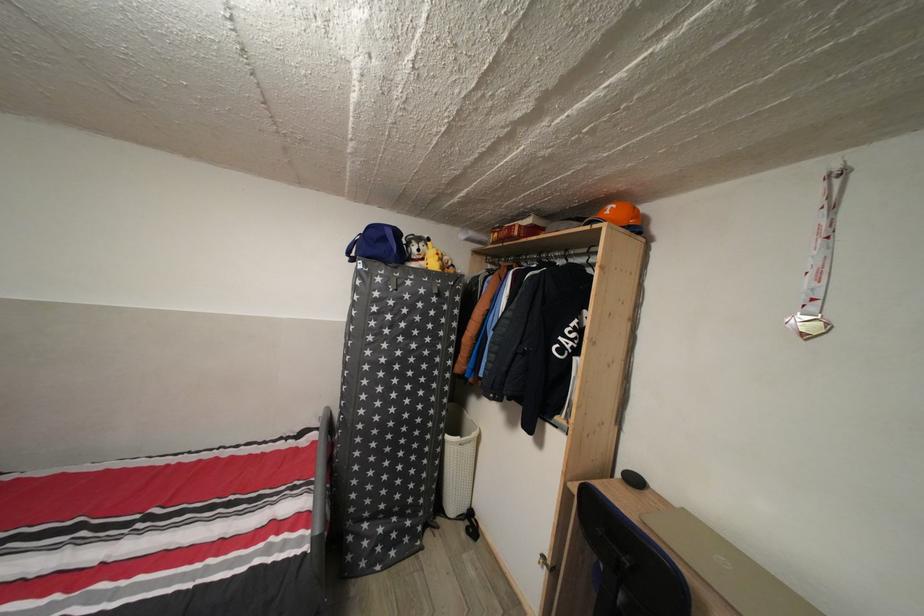
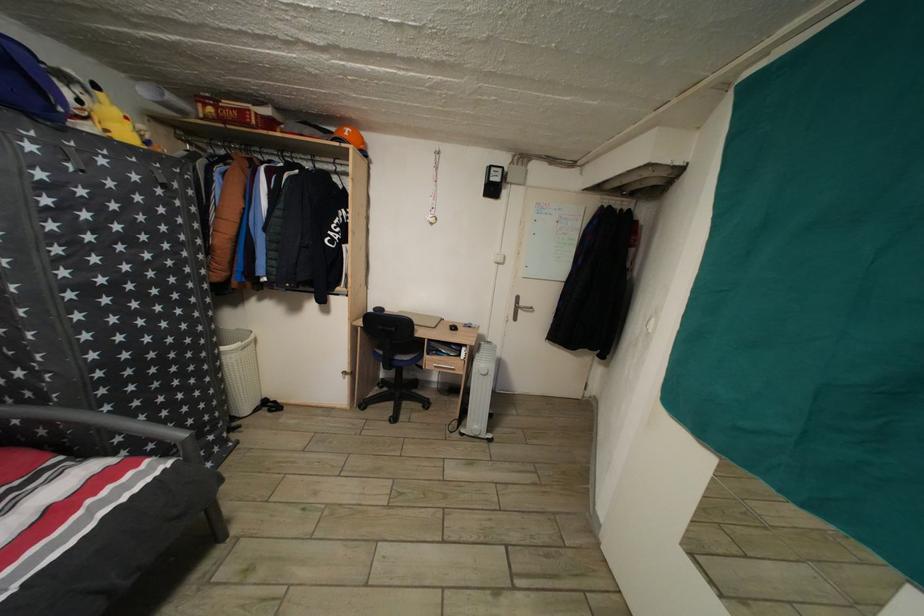
Locate, in the second image, the point that corresponds to (x=523, y=240) in the first image.

(261, 129)